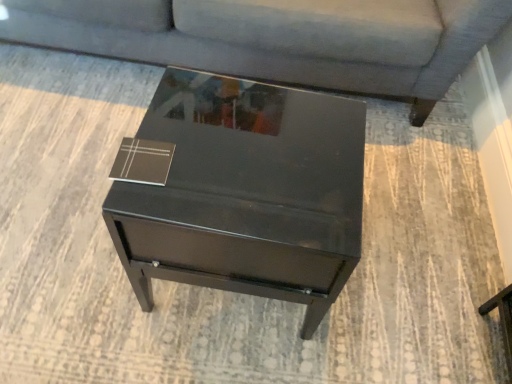
Question: Would you say matte gray couch at upper center contains brown leather book at upper left?

Choices:
 (A) no
 (B) yes

Answer: (A)

Question: From the image's perspective, does matte gray couch at upper center appear lower than brown leather book at upper left?

Choices:
 (A) no
 (B) yes

Answer: (A)

Question: Is matte gray couch at upper center further to the viewer compared to brown leather book at upper left?

Choices:
 (A) yes
 (B) no

Answer: (A)

Question: Is there a large distance between matte gray couch at upper center and brown leather book at upper left?

Choices:
 (A) no
 (B) yes

Answer: (A)

Question: Is matte gray couch at upper center bigger than brown leather book at upper left?

Choices:
 (A) yes
 (B) no

Answer: (A)

Question: Based on their sizes in the image, would you say glossy black table at center is bigger or smaller than brown leather book at upper left?

Choices:
 (A) small
 (B) big

Answer: (B)

Question: In terms of width, does glossy black table at center look wider or thinner when compared to brown leather book at upper left?

Choices:
 (A) thin
 (B) wide

Answer: (B)

Question: From a real-world perspective, is glossy black table at center positioned above or below brown leather book at upper left?

Choices:
 (A) below
 (B) above

Answer: (A)

Question: Based on their positions, is glossy black table at center located to the left or right of brown leather book at upper left?

Choices:
 (A) right
 (B) left

Answer: (A)

Question: Considering their positions, is matte gray couch at upper center located in front of or behind glossy black table at center?

Choices:
 (A) behind
 (B) front

Answer: (A)

Question: Would you say matte gray couch at upper center is to the left or to the right of glossy black table at center in the picture?

Choices:
 (A) right
 (B) left

Answer: (B)

Question: In terms of width, does matte gray couch at upper center look wider or thinner when compared to glossy black table at center?

Choices:
 (A) thin
 (B) wide

Answer: (B)

Question: Which is correct: matte gray couch at upper center is inside glossy black table at center, or outside of it?

Choices:
 (A) outside
 (B) inside

Answer: (A)

Question: Which is correct: glossy black table at center is inside matte gray couch at upper center, or outside of it?

Choices:
 (A) outside
 (B) inside

Answer: (A)

Question: In the image, is glossy black table at center on the left side or the right side of matte gray couch at upper center?

Choices:
 (A) left
 (B) right

Answer: (B)